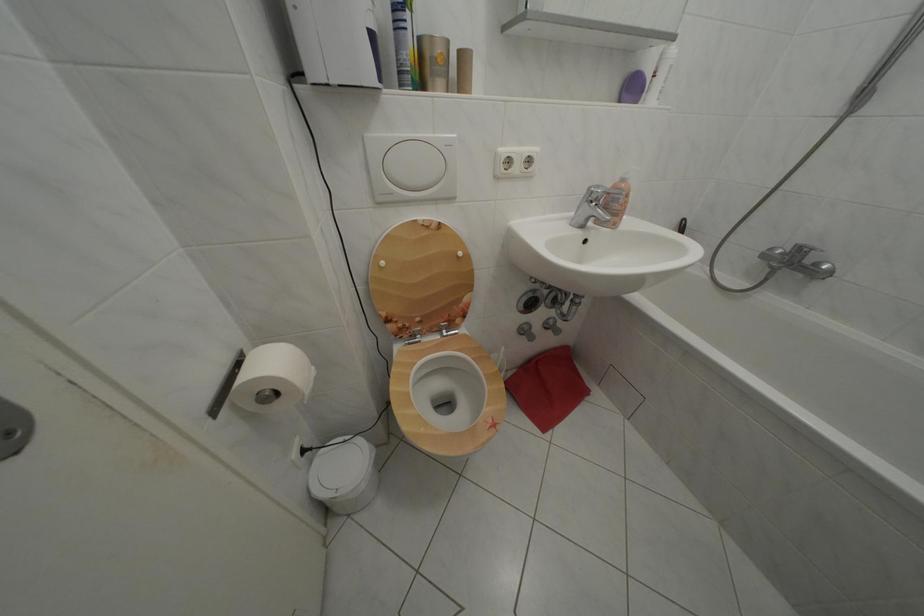
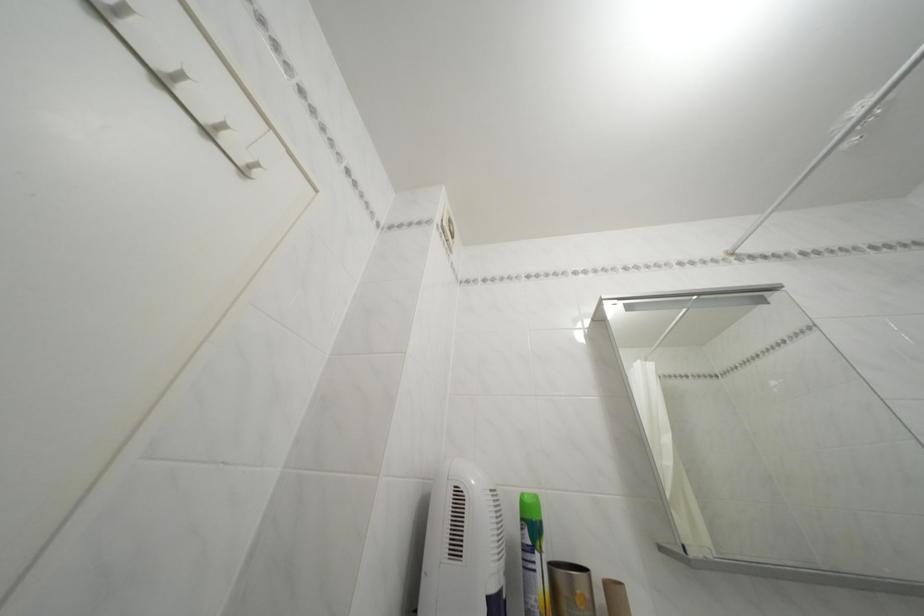
The point at (468, 59) is marked in the first image. Where is the corresponding point in the second image?

(614, 591)